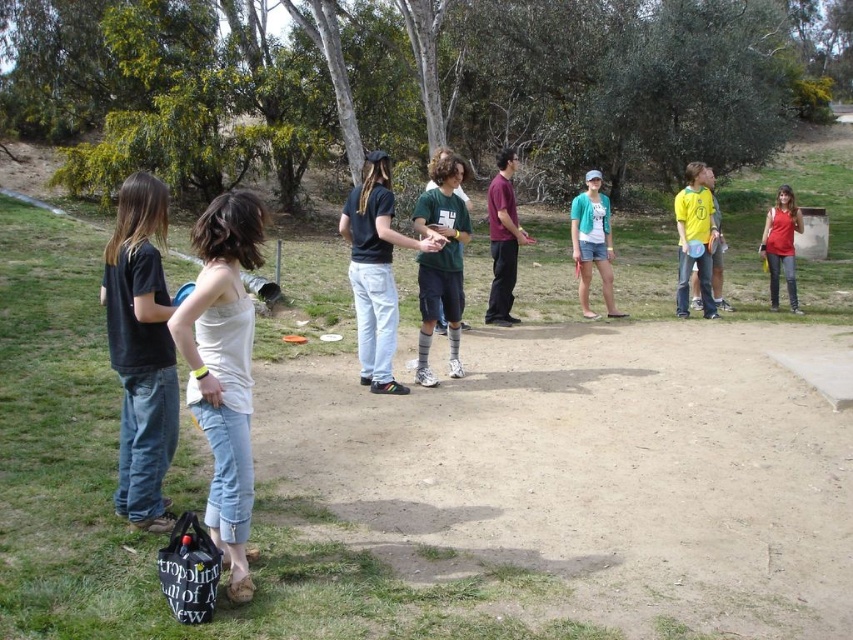
You are standing in the park and want to throw a frisbee to a friend. You see two points in the image, point 1 at coordinates point (157, 509) and point 2 at coordinates point (454, 244). Which point is closer to you?

Point 1 at coordinates point (157, 509) is closer to you than point 2 at coordinates point (454, 244).

You are standing in the park and want to place a small flag exactly halfway between point (137,461) and point (486,314). Will the flag be closer to the camera than both points?

The flag placed halfway between point (137,461) and point (486,314) would be at the midpoint of their positions. Since point (137,461) is closer to the camera than point (486,314), the midpoint would be closer to the camera than the farther point but not necessarily closer than both. Specifically, it would be closer than point (486,314) but farther than point (137,461). Therefore, the flag will not be closer to the camera than both points.